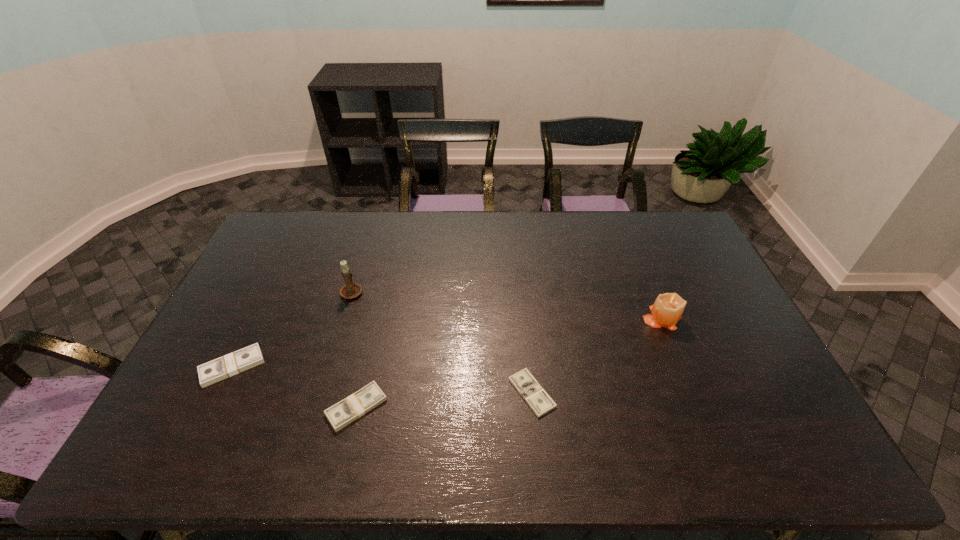
This screenshot has width=960, height=540. I want to click on free space located on the side of the candle holder with the handle, so click(x=360, y=265).

Identify the location of free location located 0.150m on the right of the candle. (731, 318).

Where is `vacant space situated 0.120m on the front of the leftmost dollar`? Image resolution: width=960 pixels, height=540 pixels. vacant space situated 0.120m on the front of the leftmost dollar is located at coordinates (201, 430).

Identify the location of free region located 0.370m on the back of the second dollar from left to right. (384, 287).

The width and height of the screenshot is (960, 540). In order to click on free location located on the right of the shortest object in this screenshot , I will do `click(694, 393)`.

Image resolution: width=960 pixels, height=540 pixels. What are the coordinates of `object at the left edge` in the screenshot? It's located at (236, 362).

Locate an element on the screen. free region at the far edge of the desktop is located at coordinates (632, 214).

Identify the location of blank space at the left edge. (274, 276).

I want to click on blank area at the right edge, so click(x=724, y=382).

You are a GUI agent. You are given a task and a screenshot of the screen. Output one action in this format:
    pyautogui.click(x=<x>, y=<y>)
    Task: Click on the vacant position at the far left corner of the desktop
    
    Given the screenshot: What is the action you would take?
    pyautogui.click(x=284, y=232)